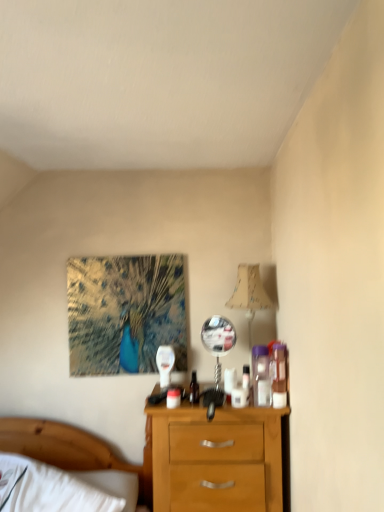
Measure the distance between point (x=239, y=291) and camera.

A distance of 7.02 feet exists between point (x=239, y=291) and camera.

What do you see at coordinates (249, 296) in the screenshot? I see `beige fabric lampshade at upper right` at bounding box center [249, 296].

What is the approximate height of white wood bed at lower left?

white wood bed at lower left is 20.26 inches in height.

What do you see at coordinates (76, 451) in the screenshot? This screenshot has height=512, width=384. I see `white wood bed at lower left` at bounding box center [76, 451].

Where is `beige fabric lampshade at upper right`? beige fabric lampshade at upper right is located at coordinates (249, 296).

Is point (246, 264) farther from camera compared to point (272, 349)?

Yes, it is.

How many degrees apart are the facing directions of beige fabric lampshade at upper right and translucent plastic container at right, which appears as the first toiletry when viewed from the right?

5.31 degrees.

Would you say beige fabric lampshade at upper right is outside translucent plastic container at right, the second toiletry positioned from the left?

Yes, beige fabric lampshade at upper right is outside of translucent plastic container at right, the second toiletry positioned from the left.

Is beige fabric lampshade at upper right shorter than translucent plastic container at right, the second toiletry positioned from the left?

Incorrect, the height of beige fabric lampshade at upper right does not fall short of that of translucent plastic container at right, the second toiletry positioned from the left.

Is white wood bed at lower left in contact with beige fabric lampshade at upper right?

No, white wood bed at lower left is not with beige fabric lampshade at upper right.

Is the depth of white wood bed at lower left less than that of beige fabric lampshade at upper right?

Yes.

Based on the photo, can you confirm if white wood bed at lower left is taller than beige fabric lampshade at upper right?

In fact, white wood bed at lower left may be shorter than beige fabric lampshade at upper right.

Is point (75, 432) farther from viewer compared to point (257, 271)?

Yes.

Which object is closer to the camera, matte plastic bottle at center or beige fabric lampshade at upper right?

matte plastic bottle at center is in front.

Is matte plastic bottle at center positioned beyond the bounds of beige fabric lampshade at upper right?

matte plastic bottle at center lies outside beige fabric lampshade at upper right's area.

How different are the orientations of matte plastic bottle at center and beige fabric lampshade at upper right in degrees?

The angular difference between matte plastic bottle at center and beige fabric lampshade at upper right is 6.09 degrees.

From the image's perspective, which is below, matte plastic bottle at center or beige fabric lampshade at upper right?

From the image's view, matte plastic bottle at center is below.

Which object is further away from the camera, white wood bed at lower left or matte plastic bottle at center?

matte plastic bottle at center is further away from the camera.

Is point (76, 467) closer to camera compared to point (190, 400)?

That is False.

Between white wood bed at lower left and matte plastic bottle at center, which one appears on the left side from the viewer's perspective?

From the viewer's perspective, white wood bed at lower left appears more on the left side.

Are white wood bed at lower left and matte plastic bottle at center making contact?

They are not placed beside each other.

This screenshot has height=512, width=384. I want to click on the 1st toiletry above the white wood bed at lower left (from the image's perspective), so click(x=261, y=376).

Between translucent plastic container at right, arranged as the second toiletry when viewed from the right, and white wood bed at lower left, which one has smaller size?

With smaller size is translucent plastic container at right, arranged as the second toiletry when viewed from the right.

Is point (256, 362) less distant than point (44, 429)?

Yes, it is.

Consider the image. Between translucent plastic container at right, arranged as the second toiletry when viewed from the right, and white wood bed at lower left, which one has less height?

With less height is translucent plastic container at right, arranged as the second toiletry when viewed from the right.

Does point (256, 364) come closer to viewer compared to point (192, 400)?

Yes, point (256, 364) is in front of point (192, 400).

Can you confirm if translucent plastic container at right, arranged as the second toiletry when viewed from the right, is smaller than matte plastic bottle at center?

Actually, translucent plastic container at right, arranged as the second toiletry when viewed from the right, might be larger than matte plastic bottle at center.

Which is closer to the camera, (273, 384) or (196, 395)?

Point (273, 384).

From the image's perspective, does translucent plastic container at right, which appears as the first toiletry when viewed from the right, appear lower than matte plastic bottle at center?

No, from the image's perspective, translucent plastic container at right, which appears as the first toiletry when viewed from the right, is not below matte plastic bottle at center.

How many degrees apart are the facing directions of translucent plastic container at right, the second toiletry positioned from the left, and matte plastic bottle at center?

They differ by 0.78 degrees in their facing directions.

Does translucent plastic container at right, which appears as the first toiletry when viewed from the right, appear on the right side of matte plastic bottle at center?

Correct, you'll find translucent plastic container at right, which appears as the first toiletry when viewed from the right, to the right of matte plastic bottle at center.

Where is `the 1st toiletry below the beige fabric lampshade at upper right (from a real-world perspective)`? This screenshot has height=512, width=384. the 1st toiletry below the beige fabric lampshade at upper right (from a real-world perspective) is located at coordinates (279, 375).

Find the location of a particular element. This screenshot has height=512, width=384. table lamp behind the white wood bed at lower left is located at coordinates (249, 296).

Considering their positions, is translucent plastic container at right, the second toiletry positioned from the left, positioned closer to beige fabric lampshade at upper right than white wood bed at lower left?

translucent plastic container at right, the second toiletry positioned from the left.

Which object lies further to the anchor point translucent plastic container at right, the 1th toiletry when ordered from left to right, translucent plastic container at right, the second toiletry positioned from the left, or beige fabric lampshade at upper right?

Among the two, beige fabric lampshade at upper right is located further to translucent plastic container at right, the 1th toiletry when ordered from left to right.

Looking at the image, which one is located further to white wood bed at lower left, matte plastic bottle at center or translucent plastic container at right, the 1th toiletry when ordered from left to right?

translucent plastic container at right, the 1th toiletry when ordered from left to right, lies further to white wood bed at lower left than the other object.

From the image, which object appears to be nearer to translucent plastic container at right, the second toiletry positioned from the left, matte plastic bottle at center or beige fabric lampshade at upper right?

The object closer to translucent plastic container at right, the second toiletry positioned from the left, is beige fabric lampshade at upper right.

From the image, which object appears to be nearer to white wood bed at lower left, translucent plastic container at right, the 1th toiletry when ordered from left to right, or beige fabric lampshade at upper right?

translucent plastic container at right, the 1th toiletry when ordered from left to right, is closer to white wood bed at lower left.

Looking at the image, which one is located further to translucent plastic container at right, the 1th toiletry when ordered from left to right, matte plastic bottle at center or translucent plastic container at right, the second toiletry positioned from the left?

Among the two, matte plastic bottle at center is located further to translucent plastic container at right, the 1th toiletry when ordered from left to right.

When comparing their distances from beige fabric lampshade at upper right, does white wood bed at lower left or matte plastic bottle at center seem further?

The object further to beige fabric lampshade at upper right is white wood bed at lower left.

In the scene shown: Which object lies further to the anchor point translucent plastic container at right, the 1th toiletry when ordered from left to right, translucent plastic container at right, the second toiletry positioned from the left, or matte plastic bottle at center?

matte plastic bottle at center is positioned further to the anchor translucent plastic container at right, the 1th toiletry when ordered from left to right.

The width and height of the screenshot is (384, 512). In order to click on table lamp between matte plastic bottle at center and translucent plastic container at right, the second toiletry positioned from the left, in the horizontal direction in this screenshot , I will do `click(249, 296)`.

You are a GUI agent. You are given a task and a screenshot of the screen. Output one action in this format:
    pyautogui.click(x=<x>, y=<y>)
    Task: Click on the toiletry located between matte plastic bottle at center and translucent plastic container at right, the second toiletry positioned from the left, in the left-right direction
    The width and height of the screenshot is (384, 512).
    Given the screenshot: What is the action you would take?
    pyautogui.click(x=261, y=376)

The height and width of the screenshot is (512, 384). In order to click on bottle between white wood bed at lower left and translucent plastic container at right, the second toiletry positioned from the left, from left to right in this screenshot , I will do `click(194, 389)`.

Locate an element on the screen. The width and height of the screenshot is (384, 512). toiletry between translucent plastic container at right, arranged as the second toiletry when viewed from the right, and beige fabric lampshade at upper right from front to back is located at coordinates (279, 375).